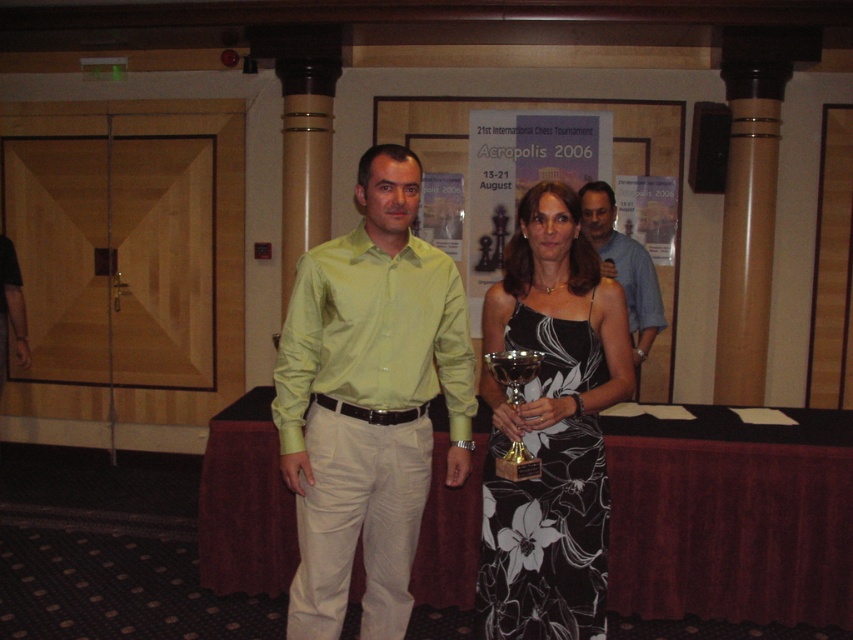
You are organizing a clothing donation drive and need to decide which shirt to place in the large size bin. You see a matte blue shirt at center and a blue cotton shirt at center. Which one should you choose?

The matte blue shirt at center is bigger than the blue cotton shirt at center, so you should choose the matte blue shirt at center for the large size bin.

You are organizing a photo shoot and need to place a camera stand between the matte blue shirt at center and the blue cotton shirt at center. The camera stand requires at least 0.5 meters of space between the two shirts. Can you determine if there is enough space based on their widths?

The matte blue shirt at center is wider than the blue cotton shirt at center. However, the exact distance between them isn t specified in the description, so we can t confirm if there s enough space for the camera stand.